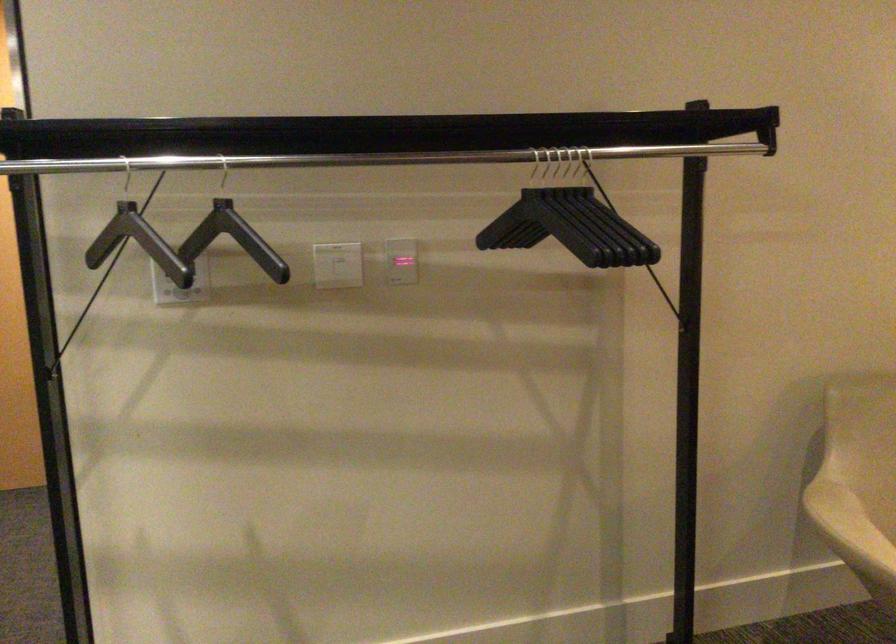
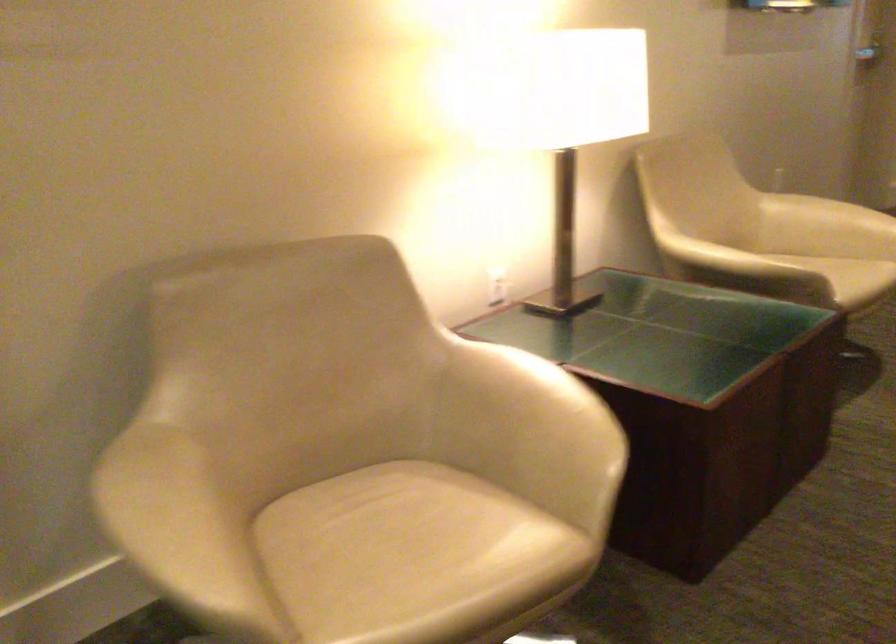
Question: The first image is from the beginning of the video and the second image is from the end. How did the camera likely rotate when shooting the video?

Choices:
 (A) Left
 (B) Right
 (C) Up
 (D) Down

Answer: (B)